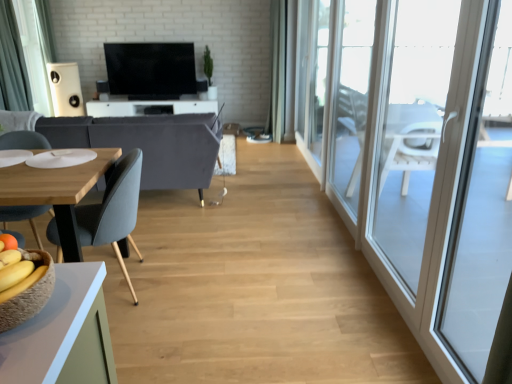
Image resolution: width=512 pixels, height=384 pixels. I want to click on free point behind matte gray chair at left, so click(x=162, y=245).